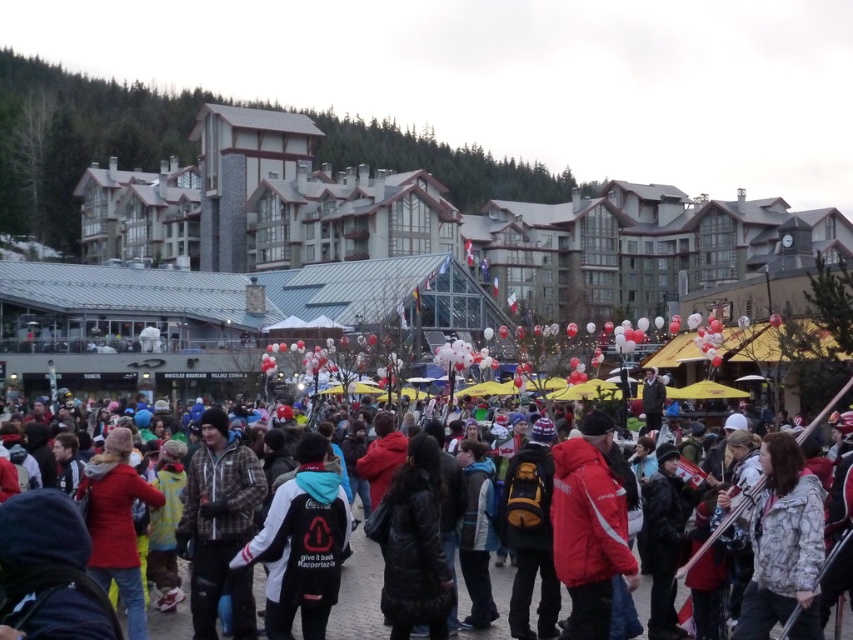
Can you confirm if white textured jacket at lower right is taller than dark gray jacket at center?

No, white textured jacket at lower right is not taller than dark gray jacket at center.

Which is below, white textured jacket at lower right or dark gray jacket at center?

dark gray jacket at center is lower down.

Between point (805, 497) and point (378, 572), which one is positioned in front?

Positioned in front is point (805, 497).

Locate an element on the screen. white textured jacket at lower right is located at coordinates (782, 545).

Who is lower down, black fleece jacket at center or dark gray jacket at center?

black fleece jacket at center is below.

Is black fleece jacket at center thinner than dark gray jacket at center?

Yes.

What do you see at coordinates (300, 545) in the screenshot?
I see `black fleece jacket at center` at bounding box center [300, 545].

At what (x,y) coordinates should I click in order to perform the action: click on black fleece jacket at center. Please return your answer as a coordinate pair (x, y). Looking at the image, I should click on [300, 545].

Can you confirm if wooden ski resort at center is taller than white textured jacket at lower right?

Correct, wooden ski resort at center is much taller as white textured jacket at lower right.

Is point (467, 257) positioned in front of point (785, 605)?

No, (467, 257) is behind (785, 605).

Is point (287, 264) positioned after point (753, 605)?

Yes, it is.

Locate an element on the screen. wooden ski resort at center is located at coordinates (434, 225).